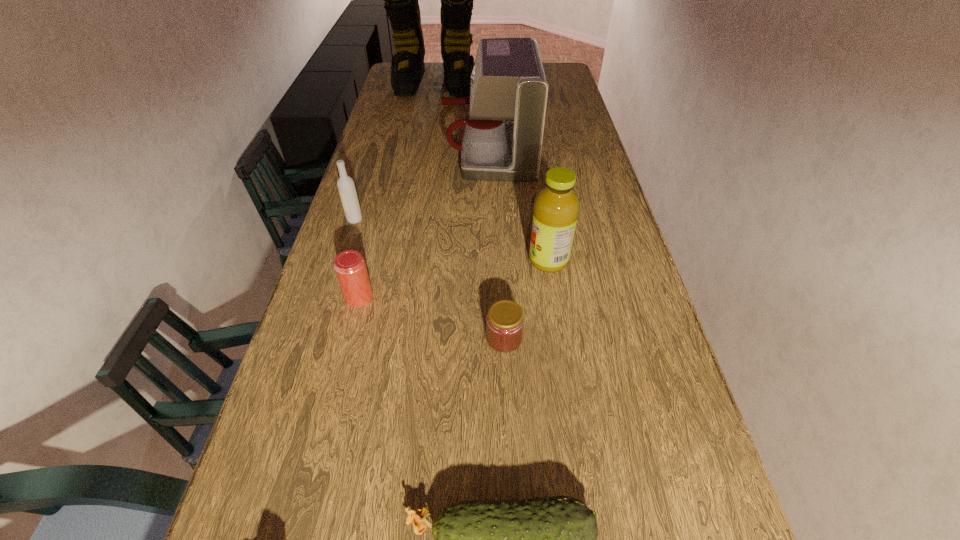
This screenshot has width=960, height=540. Find the location of `ski boots`. ski boots is located at coordinates (401, 0).

This screenshot has height=540, width=960. Identify the location of the farthest object. (401, 0).

In order to click on coffee maker in this screenshot , I will do `click(502, 137)`.

Find the location of a particular element. The height and width of the screenshot is (540, 960). the sixth nearest object is located at coordinates (502, 137).

I want to click on fruit juice, so click(x=556, y=208).

What are the coordinates of `the fifth shortest object` in the screenshot? It's located at [x=556, y=208].

Where is `the fourth tallest object`? the fourth tallest object is located at coordinates (345, 184).

Find the location of a particular element. This screenshot has height=540, width=960. vodka is located at coordinates (345, 184).

The image size is (960, 540). What are the coordinates of `the third nearest object` in the screenshot? It's located at (350, 267).

At what (x,y) coordinates should I click in order to perform the action: click on beer can. Please return your answer as a coordinate pair (x, y). The image size is (960, 540). Looking at the image, I should click on (350, 267).